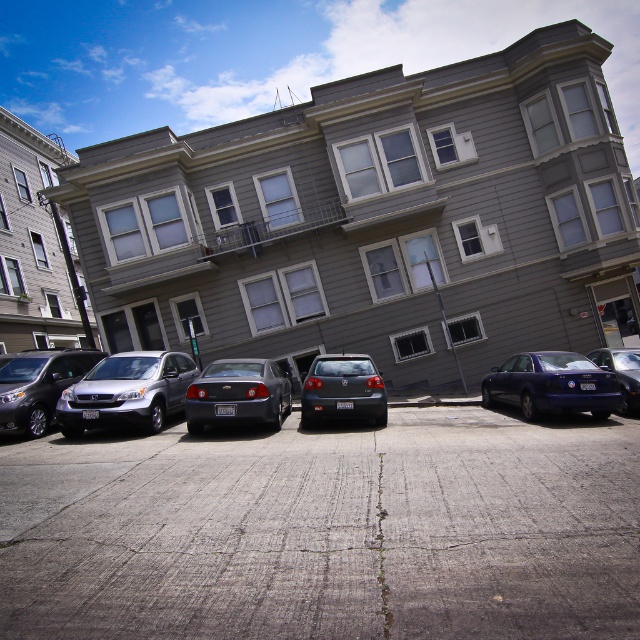
Question: Which object is positioned closest to the matte gray sedan at center?

Choices:
 (A) shiny black sedan at right
 (B) matte black sedan at center

Answer: (B)

Question: Does satin silver suv at center lie behind shiny dark blue sedan at center right?

Choices:
 (A) no
 (B) yes

Answer: (A)

Question: Is shiny dark blue sedan at center right positioned at the back of matte gray sedan at center?

Choices:
 (A) yes
 (B) no

Answer: (A)

Question: Is satin silver suv at center to the left of silver metallic minivan at left from the viewer's perspective?

Choices:
 (A) yes
 (B) no

Answer: (B)

Question: Which point is farther to the camera?

Choices:
 (A) (6, 381)
 (B) (65, 392)
 (C) (204, 412)
 (D) (364, 406)

Answer: (A)

Question: Which point is closer to the camera?

Choices:
 (A) shiny dark blue sedan at center right
 (B) matte black sedan at center
 (C) shiny black sedan at right
 (D) silver metallic minivan at left

Answer: (D)